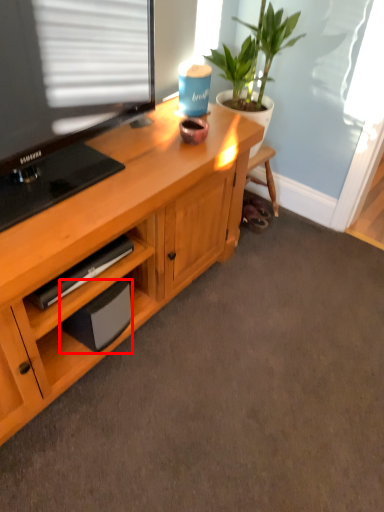
Question: Where is speaker (annotated by the red box) located in relation to houseplant in the image?

Choices:
 (A) right
 (B) left

Answer: (B)